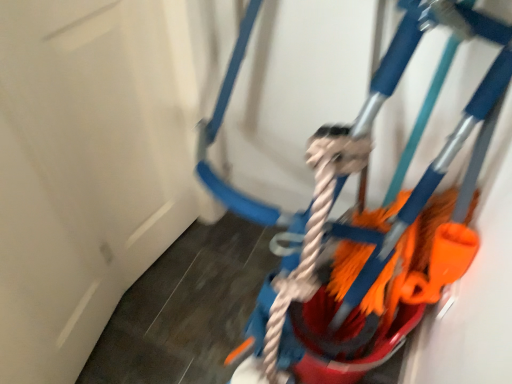
Question: Considering the relative sizes of white matte door at upper left and orange fabric mop at right in the image provided, is white matte door at upper left shorter than orange fabric mop at right?

Choices:
 (A) yes
 (B) no

Answer: (B)

Question: From the image's perspective, is white matte door at upper left located above orange fabric mop at right?

Choices:
 (A) yes
 (B) no

Answer: (B)

Question: Does white matte door at upper left have a greater height compared to orange fabric mop at right?

Choices:
 (A) no
 (B) yes

Answer: (B)

Question: Is white matte door at upper left bigger than orange fabric mop at right?

Choices:
 (A) yes
 (B) no

Answer: (B)

Question: Considering the relative sizes of white matte door at upper left and orange fabric mop at right in the image provided, is white matte door at upper left wider than orange fabric mop at right?

Choices:
 (A) no
 (B) yes

Answer: (A)

Question: Can you confirm if white matte door at upper left is thinner than orange fabric mop at right?

Choices:
 (A) yes
 (B) no

Answer: (A)

Question: Can you confirm if orange fabric mop at right is smaller than white matte door at upper left?

Choices:
 (A) yes
 (B) no

Answer: (B)

Question: Does orange fabric mop at right have a greater height compared to white matte door at upper left?

Choices:
 (A) yes
 (B) no

Answer: (B)

Question: Is the position of orange fabric mop at right less distant than that of white matte door at upper left?

Choices:
 (A) yes
 (B) no

Answer: (B)

Question: Is orange fabric mop at right oriented away from white matte door at upper left?

Choices:
 (A) no
 (B) yes

Answer: (A)

Question: Is orange fabric mop at right to the right of white matte door at upper left from the viewer's perspective?

Choices:
 (A) yes
 (B) no

Answer: (A)

Question: Is orange fabric mop at right to the left of white matte door at upper left from the viewer's perspective?

Choices:
 (A) no
 (B) yes

Answer: (A)

Question: Considering the positions of orange fabric mop at right and white matte door at upper left in the image, is orange fabric mop at right taller or shorter than white matte door at upper left?

Choices:
 (A) tall
 (B) short

Answer: (B)